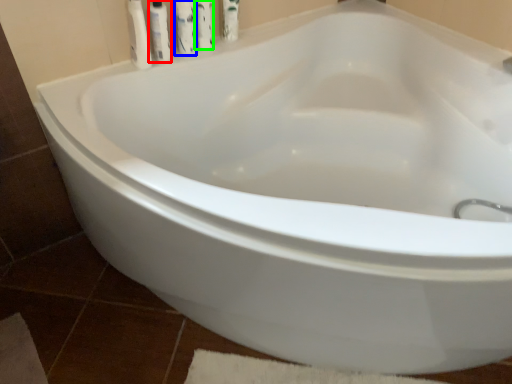
Question: Which object is positioned closest to toiletry (highlighted by a red box)? Select from cleaning product (highlighted by a blue box) and cleaning product (highlighted by a green box).

Choices:
 (A) cleaning product
 (B) cleaning product

Answer: (A)